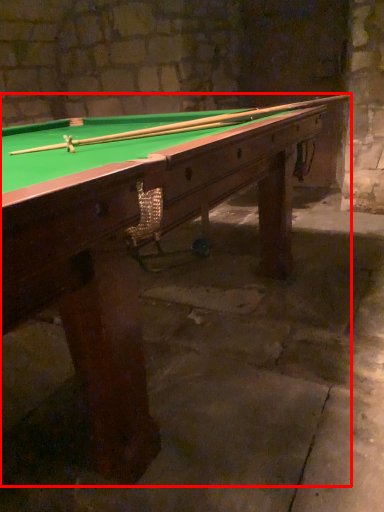
Question: From the image's perspective, what is the correct spatial relationship of billiard table (annotated by the red box) in relation to cue?

Choices:
 (A) below
 (B) above

Answer: (A)